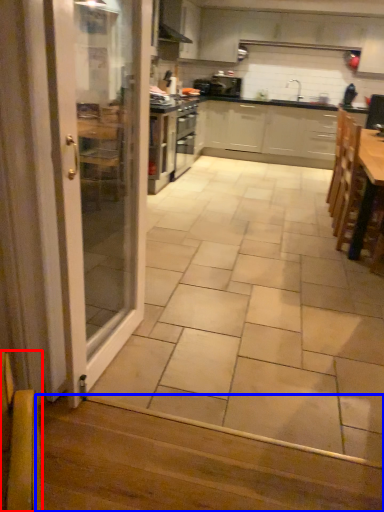
Question: Which object is closer to the camera taking this photo, armchair (highlighted by a red box) or stair (highlighted by a blue box)?

Choices:
 (A) armchair
 (B) stair

Answer: (A)